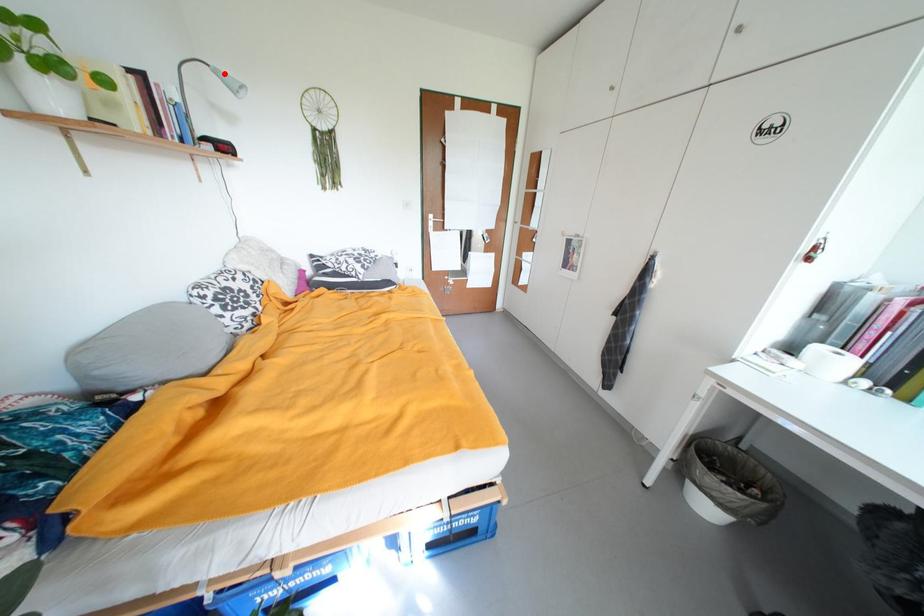
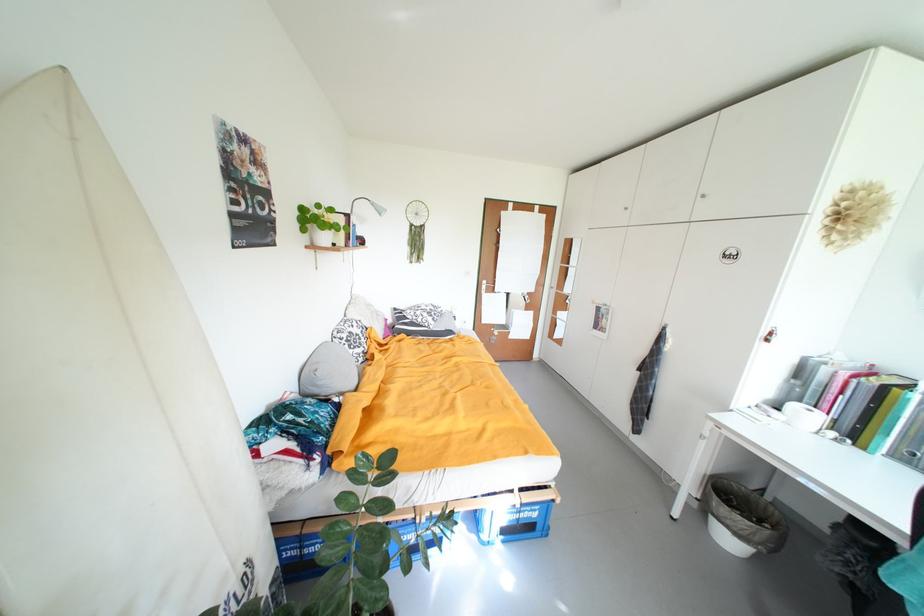
Question: I am providing you with two images of the same scene from different viewpoints. A red point is marked on the first image. Is the red point's position out of view in image 2?

Choices:
 (A) Yes
 (B) No

Answer: (B)